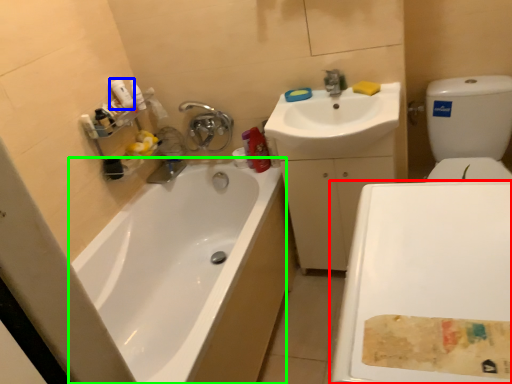
Question: Estimate the real-world distances between objects in this image. Which object is farther from plain (highlighted by a red box), cleaning product (highlighted by a blue box) or bathtub (highlighted by a green box)?

Choices:
 (A) cleaning product
 (B) bathtub

Answer: (A)